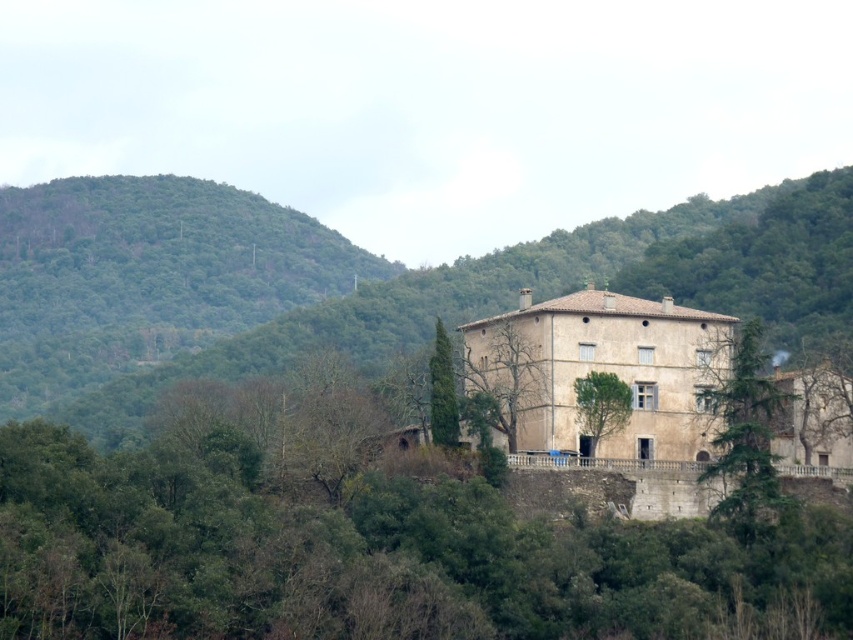
Is point (13, 228) more distant than point (450, 432)?

Yes, point (13, 228) is behind point (450, 432).

Image resolution: width=853 pixels, height=640 pixels. Find the location of `green leafy hillside at upper left`. green leafy hillside at upper left is located at coordinates (148, 276).

Does point (45, 337) lie in front of point (430, 428)?

No, it is not.

You are a GUI agent. You are given a task and a screenshot of the screen. Output one action in this format:
    pyautogui.click(x=<x>, y=<y>)
    Task: Click on the green leafy hillside at upper left
    This screenshot has width=853, height=640.
    Given the screenshot: What is the action you would take?
    pyautogui.click(x=148, y=276)

From the picture: Can you confirm if green leafy tree at right is wider than bare branches at center?

Incorrect, green leafy tree at right's width does not surpass bare branches at center's.

Does green leafy tree at right have a lesser height compared to bare branches at center?

Incorrect, green leafy tree at right's height does not fall short of bare branches at center's.

Which is in front, point (729, 461) or point (492, 356)?

Point (729, 461) is in front.

Locate an element on the screen. green leafy tree at right is located at coordinates (746, 440).

Is bare branches at center above green leafy tree at center?

Correct, bare branches at center is located above green leafy tree at center.

Image resolution: width=853 pixels, height=640 pixels. What do you see at coordinates (503, 372) in the screenshot?
I see `bare branches at center` at bounding box center [503, 372].

Between point (492, 369) and point (596, 417), which one is positioned behind?

The point (492, 369) is behind.

At what (x,y) coordinates should I click in order to perform the action: click on bare branches at center. Please return your answer as a coordinate pair (x, y). Image resolution: width=853 pixels, height=640 pixels. Looking at the image, I should click on (503, 372).